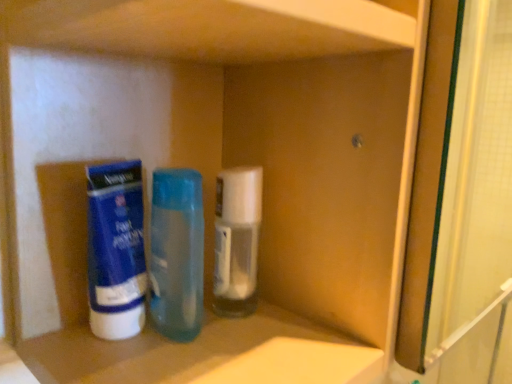
What is the approximate height of blue matte tube at left?

11.80 centimeters.

Find the location of `blue matte tube at left`. blue matte tube at left is located at coordinates (116, 250).

Does white plastic container at center, acting as the first bottle starting from the right, appear on the left side of translucent plastic bottle at center, the 2th bottle viewed from the right?

No, white plastic container at center, acting as the first bottle starting from the right, is not to the left of translucent plastic bottle at center, the 2th bottle viewed from the right.

From the image's perspective, is white plastic container at center, the second bottle from the left, above or below translucent plastic bottle at center, positioned as the 1th bottle in left-to-right order?

white plastic container at center, the second bottle from the left, is situated higher than translucent plastic bottle at center, positioned as the 1th bottle in left-to-right order, in the image.

Which of these two, white plastic container at center, the second bottle from the left, or translucent plastic bottle at center, the 2th bottle viewed from the right, is bigger?

Bigger between the two is translucent plastic bottle at center, the 2th bottle viewed from the right.

From a real-world perspective, who is located lower, white plastic container at center, acting as the first bottle starting from the right, or translucent plastic bottle at center, positioned as the 1th bottle in left-to-right order?

translucent plastic bottle at center, positioned as the 1th bottle in left-to-right order, is physically lower.

Who is more distant, blue matte tube at left or white plastic container at center, the second bottle from the left?

white plastic container at center, the second bottle from the left, is more distant.

Is blue matte tube at left located outside white plastic container at center, the second bottle from the left?

Indeed, blue matte tube at left is completely outside white plastic container at center, the second bottle from the left.

From the image's perspective, does blue matte tube at left appear lower than white plastic container at center, acting as the first bottle starting from the right?

Correct, blue matte tube at left appears lower than white plastic container at center, acting as the first bottle starting from the right, in the image.

What's the angular difference between blue matte tube at left and white plastic container at center, acting as the first bottle starting from the right,'s facing directions?

The facing directions of blue matte tube at left and white plastic container at center, acting as the first bottle starting from the right, are 9.44 degrees apart.

From the image's perspective, is translucent plastic bottle at center, the 2th bottle viewed from the right, above or below white plastic container at center, acting as the first bottle starting from the right?

translucent plastic bottle at center, the 2th bottle viewed from the right, is below white plastic container at center, acting as the first bottle starting from the right.

Considering the positions of points (167, 253) and (238, 264), is point (167, 253) closer to camera compared to point (238, 264)?

No, (167, 253) is behind (238, 264).

Would you consider translucent plastic bottle at center, positioned as the 1th bottle in left-to-right order, to be distant from white plastic container at center, the second bottle from the left?

They are positioned close to each other.

Does translucent plastic bottle at center, the 2th bottle viewed from the right, have a greater width compared to white plastic container at center, acting as the first bottle starting from the right?

Correct, the width of translucent plastic bottle at center, the 2th bottle viewed from the right, exceeds that of white plastic container at center, acting as the first bottle starting from the right.

In the scene shown: Does blue matte tube at left have a smaller size compared to translucent plastic bottle at center, positioned as the 1th bottle in left-to-right order?

Yes.

From a real-world perspective, relative to translucent plastic bottle at center, positioned as the 1th bottle in left-to-right order, is blue matte tube at left vertically above or below?

blue matte tube at left is situated lower than translucent plastic bottle at center, positioned as the 1th bottle in left-to-right order, in the real world.

Is blue matte tube at left facing towards translucent plastic bottle at center, positioned as the 1th bottle in left-to-right order?

No.

What's the angular difference between translucent plastic bottle at center, the 2th bottle viewed from the right, and blue matte tube at left's facing directions?

The angular difference between translucent plastic bottle at center, the 2th bottle viewed from the right, and blue matte tube at left is 107 degrees.

Is translucent plastic bottle at center, the 2th bottle viewed from the right, completely or partially outside of blue matte tube at left?

Yes.

Considering the sizes of objects translucent plastic bottle at center, positioned as the 1th bottle in left-to-right order, and blue matte tube at left in the image provided, who is wider, translucent plastic bottle at center, positioned as the 1th bottle in left-to-right order, or blue matte tube at left?

Wider between the two is translucent plastic bottle at center, positioned as the 1th bottle in left-to-right order.

This screenshot has width=512, height=384. In order to click on cleaning product directly beneath the white plastic container at center, acting as the first bottle starting from the right (from a real-world perspective) in this screenshot , I will do `click(116, 250)`.

Based on the photo, how far apart are white plastic container at center, acting as the first bottle starting from the right, and blue matte tube at left?

white plastic container at center, acting as the first bottle starting from the right, and blue matte tube at left are 7.69 centimeters apart from each other.

Consider the image. From the image's perspective, is white plastic container at center, acting as the first bottle starting from the right, located beneath blue matte tube at left?

No, from the image's perspective, white plastic container at center, acting as the first bottle starting from the right, is not beneath blue matte tube at left.

How different are the orientations of white plastic container at center, acting as the first bottle starting from the right, and blue matte tube at left in degrees?

9.44 degrees.

The width and height of the screenshot is (512, 384). I want to click on bottle that appears in front of the white plastic container at center, the second bottle from the left, so click(x=177, y=253).

The height and width of the screenshot is (384, 512). I want to click on the 2nd bottle counting from the right side of the blue matte tube at left, so click(237, 240).

Estimate the real-world distances between objects in this image. Which object is closer to blue matte tube at left, white plastic container at center, acting as the first bottle starting from the right, or translucent plastic bottle at center, positioned as the 1th bottle in left-to-right order?

Based on the image, translucent plastic bottle at center, positioned as the 1th bottle in left-to-right order, appears to be nearer to blue matte tube at left.

From the picture: Considering their positions, is translucent plastic bottle at center, the 2th bottle viewed from the right, positioned closer to blue matte tube at left than white plastic container at center, acting as the first bottle starting from the right?

Among the two, translucent plastic bottle at center, the 2th bottle viewed from the right, is located nearer to blue matte tube at left.

When comparing their distances from white plastic container at center, the second bottle from the left, does blue matte tube at left or translucent plastic bottle at center, the 2th bottle viewed from the right, seem closer?

Among the two, translucent plastic bottle at center, the 2th bottle viewed from the right, is located nearer to white plastic container at center, the second bottle from the left.

Based on their spatial positions, is translucent plastic bottle at center, positioned as the 1th bottle in left-to-right order, or blue matte tube at left further from white plastic container at center, the second bottle from the left?

blue matte tube at left lies further to white plastic container at center, the second bottle from the left, than the other object.

Looking at the image, which one is located further to translucent plastic bottle at center, the 2th bottle viewed from the right, white plastic container at center, acting as the first bottle starting from the right, or blue matte tube at left?

blue matte tube at left.

From the image, which object appears to be nearer to translucent plastic bottle at center, the 2th bottle viewed from the right, blue matte tube at left or white plastic container at center, acting as the first bottle starting from the right?

Based on the image, white plastic container at center, acting as the first bottle starting from the right, appears to be nearer to translucent plastic bottle at center, the 2th bottle viewed from the right.

The width and height of the screenshot is (512, 384). Find the location of `bottle between blue matte tube at left and white plastic container at center, acting as the first bottle starting from the right, in the horizontal direction`. bottle between blue matte tube at left and white plastic container at center, acting as the first bottle starting from the right, in the horizontal direction is located at coordinates (177, 253).